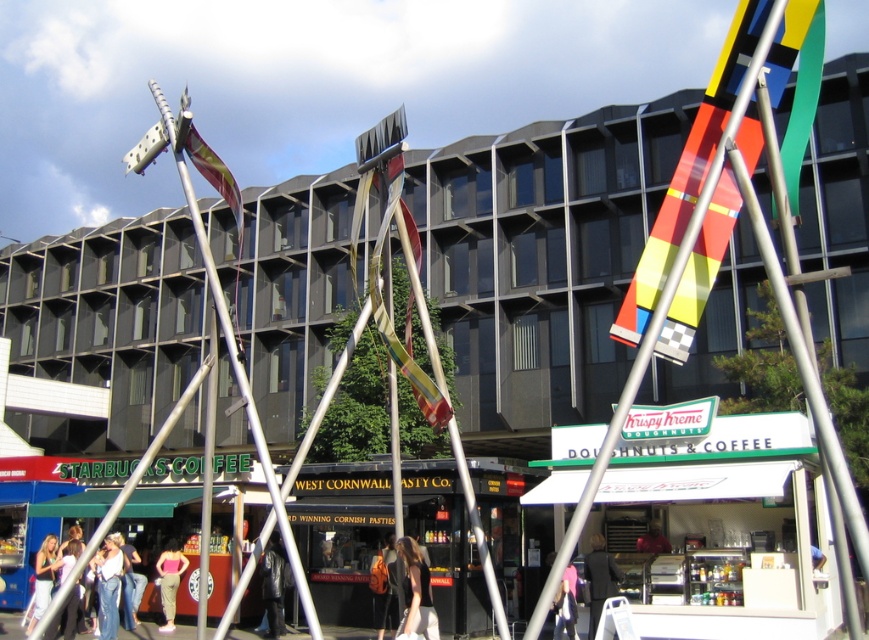
You are standing at the center of the image and want to place a new decorative flag exactly where the multicolored fabric banner at center is currently located. What are the coordinates of the point where you should place the new flag?

The coordinates for the multicolored fabric banner at center are at point (403, 352), so you should place the new flag at those coordinates.

You are a delivery drone that needs to fly from the light pink fabric at lower left to the pink fabric at lower center. The drone has a maximum flight range of 20 meters. Can it reach the destination without recharging?

The light pink fabric at lower left is 22.10 meters from the pink fabric at lower center. Since the drone can only fly 20 meters without recharging, it cannot reach the destination without recharging.

You are a pedestrian standing in the middle of the street market. You see a multicolored fabric flag at center and a dark gray jacket at center. Which object is higher in the scene?

The multicolored fabric flag at center is above the dark gray jacket at center, so it is higher in the scene.